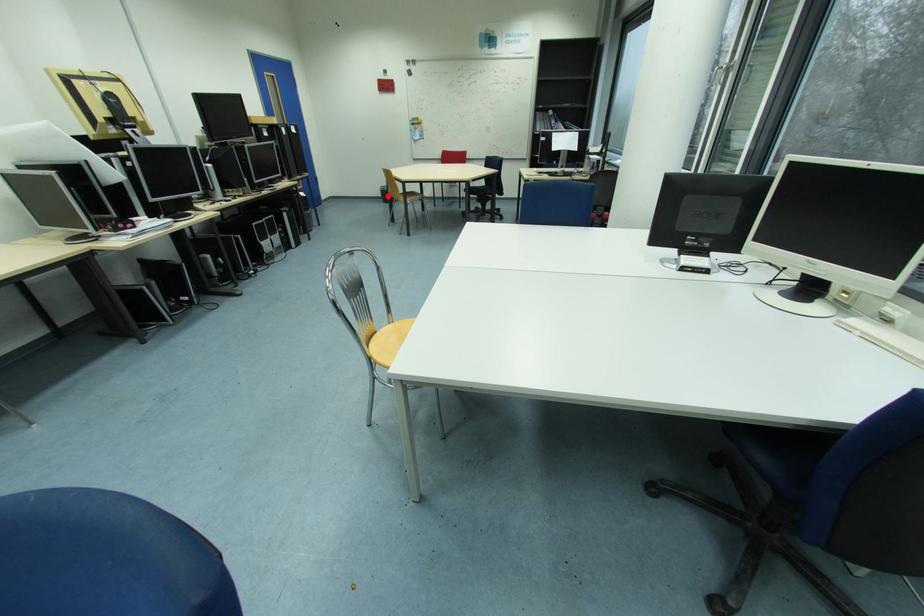
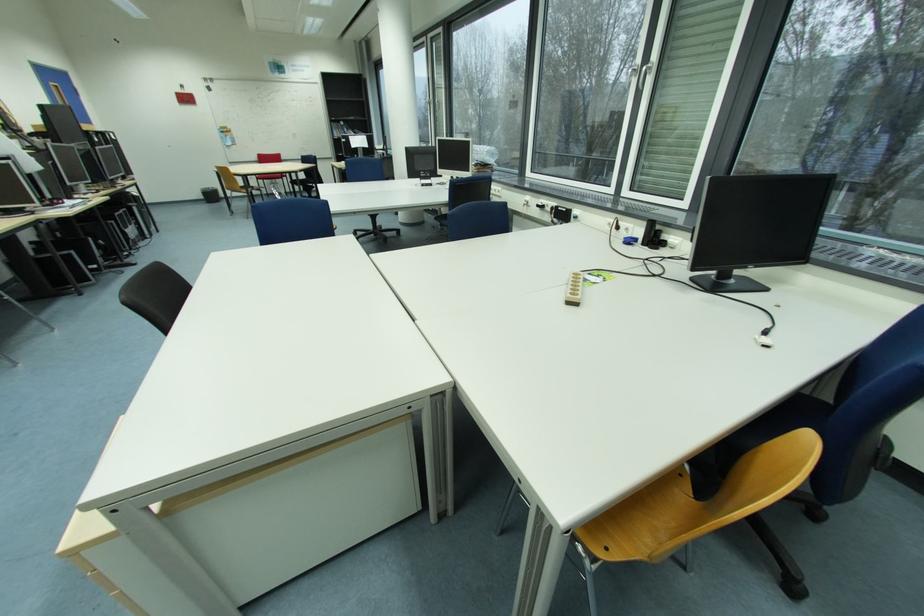
Question: I am providing you with two images of the same scene from different viewpoints. A red point is marked on the first image. Is the red point's position out of view in image 2?

Choices:
 (A) Yes
 (B) No

Answer: (B)